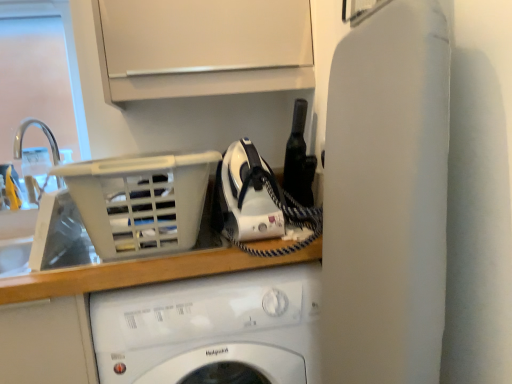
What do you see at coordinates (141, 201) in the screenshot? This screenshot has height=384, width=512. I see `white plastic basket at upper left` at bounding box center [141, 201].

Describe the element at coordinates (212, 329) in the screenshot. This screenshot has height=384, width=512. I see `white glossy washing machine at center` at that location.

The image size is (512, 384). What are the coordinates of `white plastic sink at left` in the screenshot? It's located at click(37, 229).

Is white glossy washing machine at center positioned in front of white plastic basket at upper left?

No, it is not.

Is white glossy washing machine at center next to white plastic basket at upper left?

No, white glossy washing machine at center is not touching white plastic basket at upper left.

Is white glossy washing machine at center facing away from white plastic basket at upper left?

No, white plastic basket at upper left is not at the back of white glossy washing machine at center.

Does white plastic sink at left appear on the left side of white plastic basket at upper left?

Yes, white plastic sink at left is to the left of white plastic basket at upper left.

You are a GUI agent. You are given a task and a screenshot of the screen. Output one action in this format:
    pyautogui.click(x=<x>, y=<y>)
    Task: Click on the sink lying above the white plastic basket at upper left (from the image's perspective)
    Image resolution: width=512 pixels, height=384 pixels.
    Given the screenshot: What is the action you would take?
    37,229

From a real-world perspective, between white plastic sink at left and white plastic basket at upper left, who is vertically lower?

white plastic basket at upper left.

What's the angular difference between white plastic sink at left and white plastic basket at upper left's facing directions?

The facing directions of white plastic sink at left and white plastic basket at upper left are 0.382 degrees apart.

Which is correct: white plastic sink at left is inside white glossy washing machine at center, or outside of it?

white plastic sink at left lies outside white glossy washing machine at center.

Which point is more distant from viewer, (22, 259) or (218, 319)?

The point (22, 259) is farther from the camera.

Considering the relative sizes of white plastic sink at left and white glossy washing machine at center in the image provided, is white plastic sink at left thinner than white glossy washing machine at center?

Correct, the width of white plastic sink at left is less than that of white glossy washing machine at center.

From the image's perspective, between white plastic sink at left and white glossy washing machine at center, who is located below?

From the image's view, white glossy washing machine at center is below.

Relative to white glossy washing machine at center, is white plastic basket at upper left in front or behind?

white plastic basket at upper left is positioned closer to the viewer than white glossy washing machine at center.

Considering the points (173, 223) and (117, 331), which point is in front, point (173, 223) or point (117, 331)?

The point (117, 331) is more forward.

Is white plastic basket at upper left in contact with white glossy washing machine at center?

They are not placed beside each other.

Is white plastic basket at upper left situated inside white plastic sink at left or outside?

white plastic basket at upper left is outside white plastic sink at left.

From a real-world perspective, is white plastic basket at upper left positioned above or below white plastic sink at left?

white plastic basket at upper left is below white plastic sink at left.

Which of these two, white plastic basket at upper left or white plastic sink at left, is thinner?

white plastic sink at left.

Is white glossy washing machine at center shorter than white plastic sink at left?

No, white glossy washing machine at center is not shorter than white plastic sink at left.

Can you confirm if white glossy washing machine at center is wider than white plastic sink at left?

Indeed, white glossy washing machine at center has a greater width compared to white plastic sink at left.

Considering the relative positions of white glossy washing machine at center and white plastic sink at left in the image provided, is white glossy washing machine at center to the left of white plastic sink at left from the viewer's perspective?

No, white glossy washing machine at center is not to the left of white plastic sink at left.

Are white glossy washing machine at center and white plastic sink at left beside each other?

There is a gap between white glossy washing machine at center and white plastic sink at left.

Locate an element on the screen. washing machine on the right of white plastic basket at upper left is located at coordinates (212, 329).

The width and height of the screenshot is (512, 384). Find the location of `basket below the white plastic sink at left (from the image's perspective)`. basket below the white plastic sink at left (from the image's perspective) is located at coordinates (141, 201).

Estimate the real-world distances between objects in this image. Which object is further from white plastic basket at upper left, white plastic sink at left or white glossy washing machine at center?

white plastic sink at left is further to white plastic basket at upper left.

Which object lies nearer to the anchor point white plastic sink at left, white plastic basket at upper left or white glossy washing machine at center?

white plastic basket at upper left lies closer to white plastic sink at left than the other object.

From the image, which object appears to be nearer to white glossy washing machine at center, white plastic basket at upper left or white plastic sink at left?

white plastic basket at upper left is closer to white glossy washing machine at center.

Based on their spatial positions, is white glossy washing machine at center or white plastic basket at upper left further from white plastic sink at left?

The object further to white plastic sink at left is white glossy washing machine at center.

Which object lies further to the anchor point white glossy washing machine at center, white plastic sink at left or white plastic basket at upper left?

Among the two, white plastic sink at left is located further to white glossy washing machine at center.

From the image, which object appears to be nearer to white plastic basket at upper left, white glossy washing machine at center or white plastic sink at left?

white glossy washing machine at center is positioned closer to the anchor white plastic basket at upper left.

Where is `basket between white plastic sink at left and white glossy washing machine at center in the vertical direction`? basket between white plastic sink at left and white glossy washing machine at center in the vertical direction is located at coordinates click(141, 201).